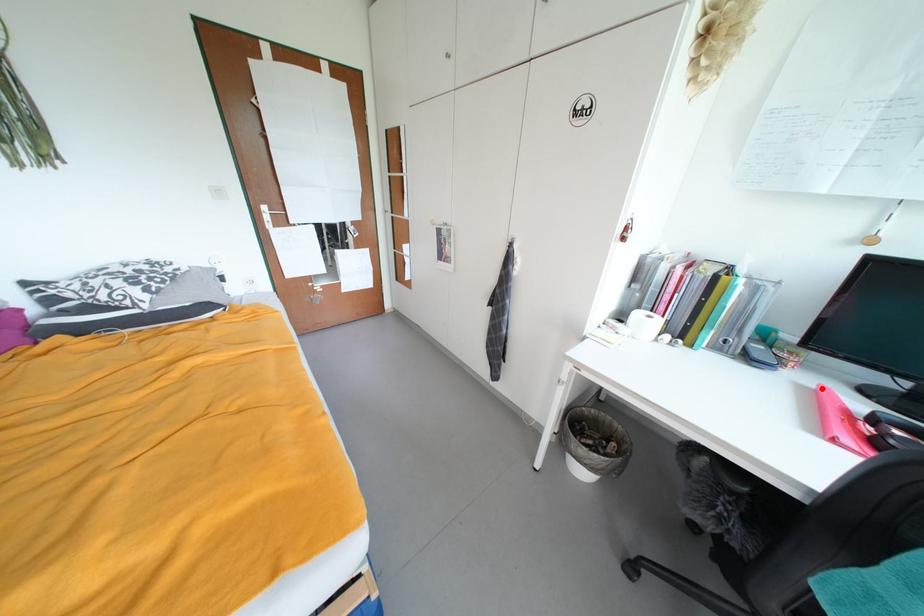
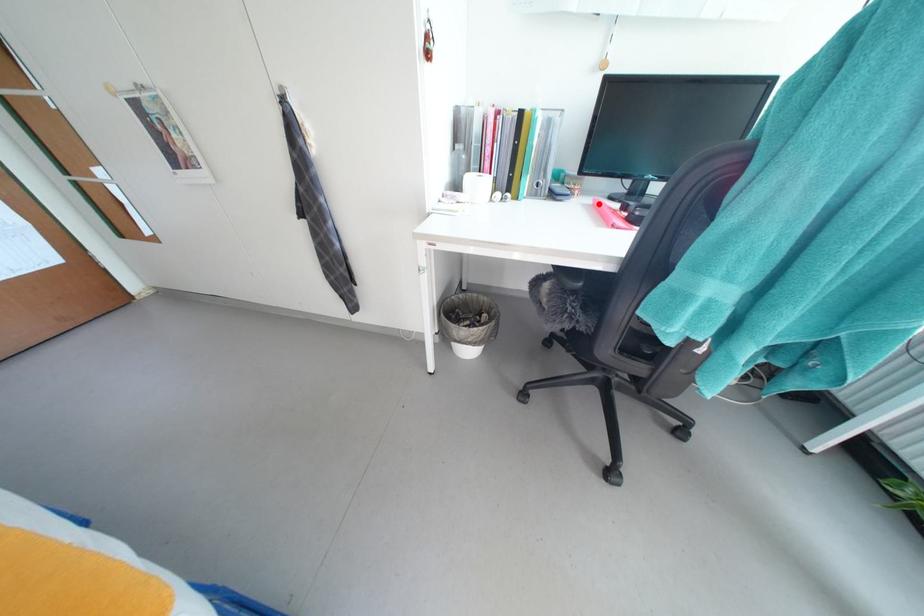
I am providing you with two images of the same scene from different viewpoints. A red point is marked on the first image and another point is marked on the second image. Is the marked point in image1 the same physical position as the marked point in image2?

Yes